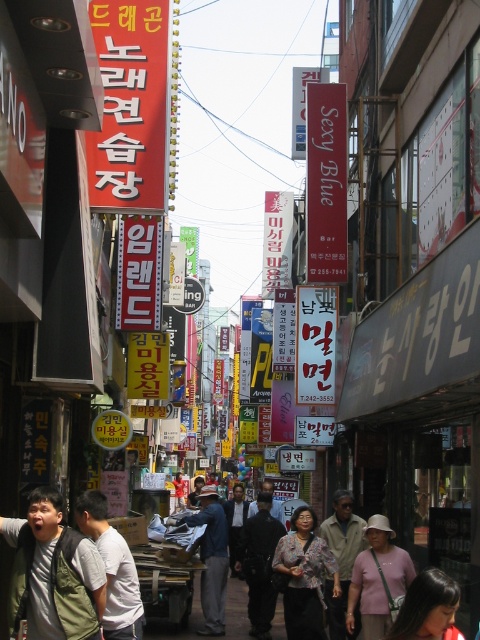
Is pink fabric bag at center bigger than light brown fabric shirt at center?

Actually, pink fabric bag at center might be smaller than light brown fabric shirt at center.

Does pink fabric bag at center appear under light brown fabric shirt at center?

No, pink fabric bag at center is not below light brown fabric shirt at center.

Image resolution: width=480 pixels, height=640 pixels. Identify the location of pink fabric bag at center. (377, 579).

Does yellow matte sign at center lie behind dark blue jeans at center?

Yes, it is behind dark blue jeans at center.

Which is more to the right, yellow matte sign at center or dark blue jeans at center?

dark blue jeans at center is more to the right.

Is point (127, 292) closer to camera compared to point (220, 620)?

No, it is behind (220, 620).

At what (x,y) coordinates should I click in order to perform the action: click on yellow matte sign at center. Please return your answer as a coordinate pair (x, y). This screenshot has height=640, width=480. Looking at the image, I should click on (139, 273).

Where is `red plastic sign at upper left`? The image size is (480, 640). red plastic sign at upper left is located at coordinates (131, 106).

Is point (116, 109) less distant than point (264, 508)?

Yes, it is.

Does point (93, 24) come behind point (263, 593)?

That is False.

Find the location of `red plastic sign at upper left`. red plastic sign at upper left is located at coordinates (131, 106).